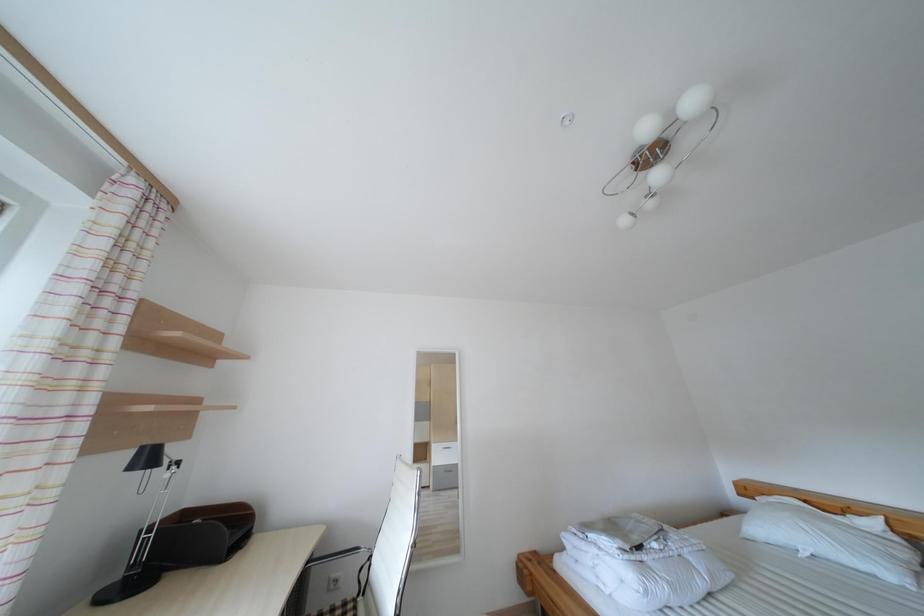
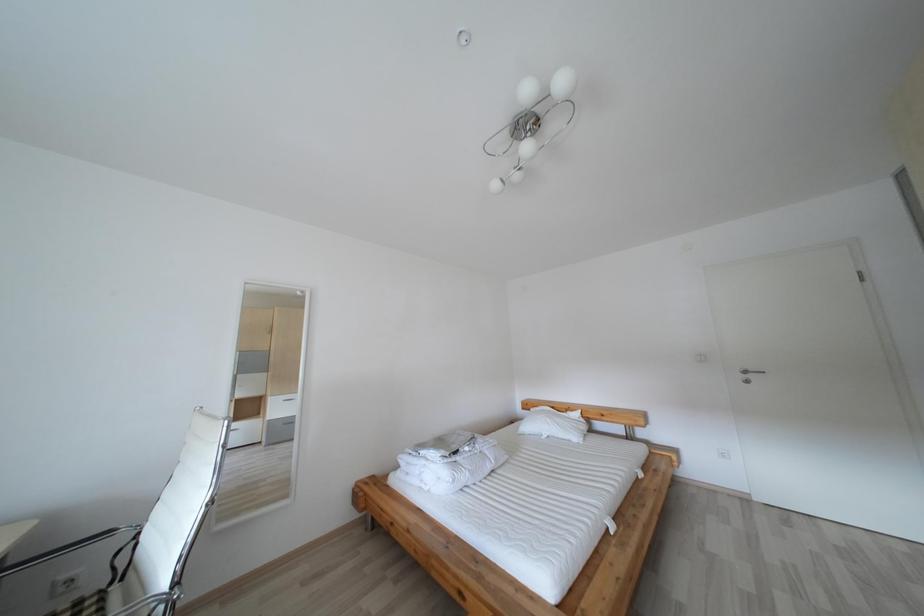
Question: The images are taken continuously from a first-person perspective. In which direction is your viewpoint rotating?

Choices:
 (A) Left
 (B) Right
 (C) Up
 (D) Down

Answer: (B)